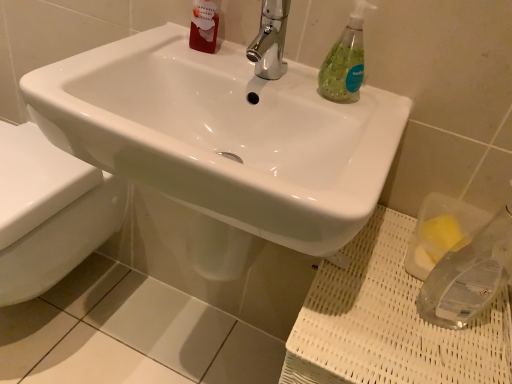
Question: Is green translucent soap dispenser at upper right to the left or to the right of chrome metallic faucet at upper center in the image?

Choices:
 (A) right
 (B) left

Answer: (A)

Question: Is green translucent soap dispenser at upper right taller or shorter than chrome metallic faucet at upper center?

Choices:
 (A) short
 (B) tall

Answer: (B)

Question: Based on their relative distances, which object is nearer to the clear plastic sponge at lower right?

Choices:
 (A) green translucent soap dispenser at upper right
 (B) white glossy sink at center
 (C) chrome metallic faucet at upper center
 (D) translucent red liquid at upper left
 (E) white glossy toilet at lower left

Answer: (B)

Question: Which object is positioned farthest from the green translucent soap dispenser at upper right?

Choices:
 (A) clear plastic sponge at lower right
 (B) white glossy toilet at lower left
 (C) chrome metallic faucet at upper center
 (D) translucent red liquid at upper left
 (E) white glossy sink at center

Answer: (B)